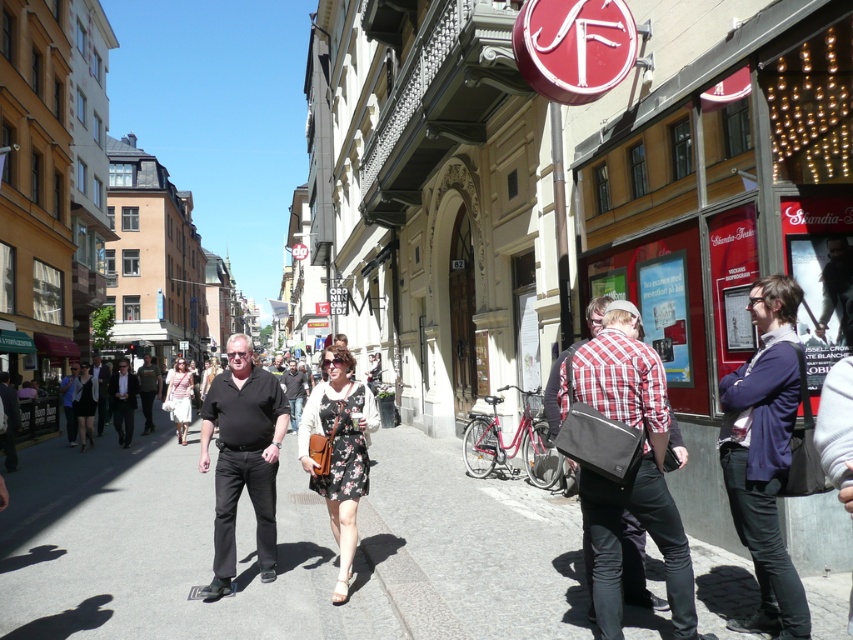
Question: Is dark gray cotton shirt at center smaller than dark gray pants at center?

Choices:
 (A) yes
 (B) no

Answer: (A)

Question: Estimate the real-world distances between objects in this image. Which object is farther from the purple cotton sweater at center?

Choices:
 (A) dark gray pants at center
 (B) black matte shirt at center
 (C) floral dress at center

Answer: (A)

Question: Which point appears farthest from the camera in this image?

Choices:
 (A) (334, 372)
 (B) (202, 452)
 (C) (151, 413)
 (D) (618, 397)

Answer: (C)

Question: Estimate the real-world distances between objects in this image. Which object is closer to the gray asphalt at center?

Choices:
 (A) dark gray pants at center
 (B) red checkered shirt at center

Answer: (B)

Question: Does red checkered shirt at center have a larger size compared to black matte shirt at center?

Choices:
 (A) yes
 (B) no

Answer: (A)

Question: Is red checkered shirt at center behind floral dress at center?

Choices:
 (A) yes
 (B) no

Answer: (B)